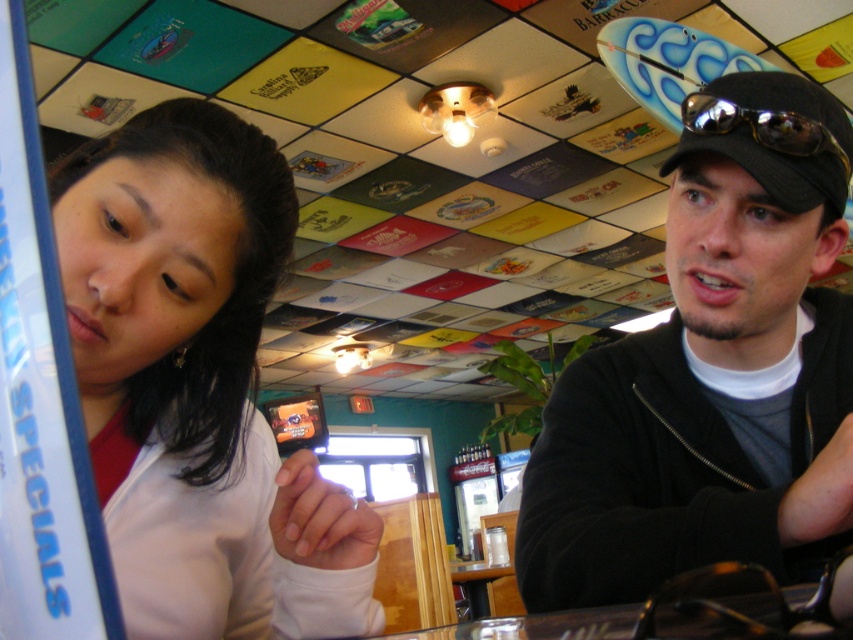
You are a painter standing 20 inches away from the canvas. You want to paint the black matte jacket at upper right. Can you reach it without moving closer?

The black matte jacket at upper right is 20.54 inches away from the viewer. Since you are standing 20 inches away, you are close enough to reach it without needing to move closer.

You are designing a storage box to fit either the black matte jacket at upper right or the sunglassesmetallicgoggles at right. Based on their sizes, which object requires a larger storage box?

The black matte jacket at upper right requires a larger storage box because it is wider than the sunglassesmetallicgoggles at right.

You are a photographer trying to capture a group photo of the black matte jacket at upper right and the matte white shirt at left. If you want to ensure both subjects are fully visible in the frame, which side should you position the wider subject on?

The black matte jacket at upper right might be wider than the matte white shirt at left, so positioning the black matte jacket at upper right on the side where the frame can accommodate its width would ensure both are visible.